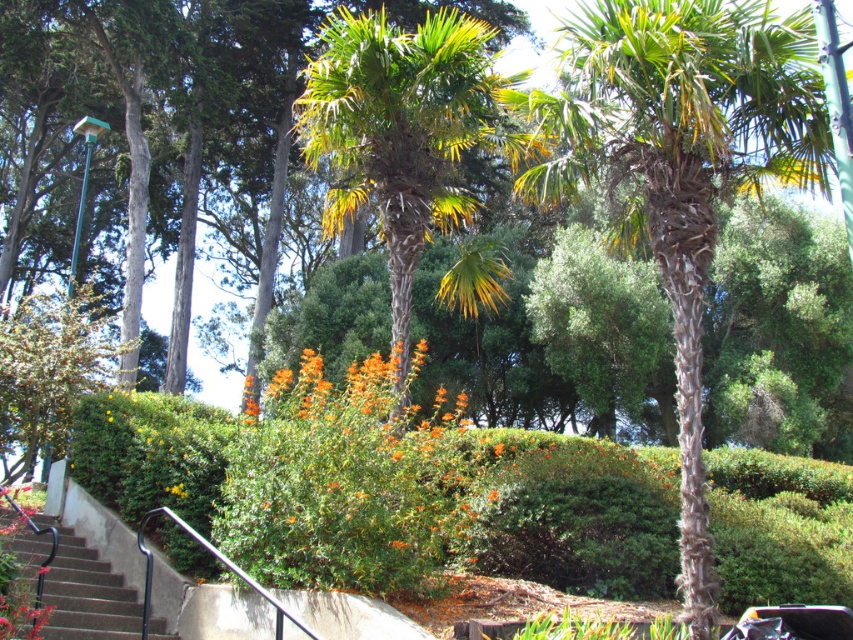
Question: Which object is the closest to the green leafy palm at center?

Choices:
 (A) orange fuzzy bush at center
 (B) green textured palm tree at center
 (C) metallic gray stairs at lower left

Answer: (A)

Question: Does green textured palm tree at center have a smaller size compared to metallic gray stairs at lower left?

Choices:
 (A) yes
 (B) no

Answer: (B)

Question: Among these points, which one is nearest to the camera?

Choices:
 (A) (808, 58)
 (B) (355, 19)

Answer: (A)

Question: Which point is farther to the camera?

Choices:
 (A) (787, 88)
 (B) (84, 637)
 (C) (363, 557)
 (D) (456, 12)

Answer: (D)

Question: Considering the relative positions of orange fuzzy bush at center and metallic gray stairs at lower left in the image provided, where is orange fuzzy bush at center located with respect to metallic gray stairs at lower left?

Choices:
 (A) left
 (B) right

Answer: (B)

Question: Can you confirm if green textured palm tree at center is thinner than green leafy palm at center?

Choices:
 (A) yes
 (B) no

Answer: (A)